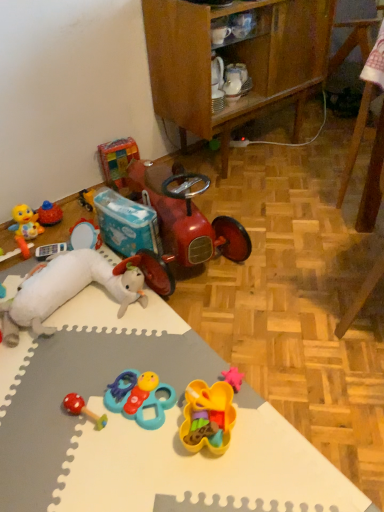
Identify the location of vacant area that lies between shiny red toy car at center and white foam mat at lower left. This screenshot has width=384, height=512. (260, 347).